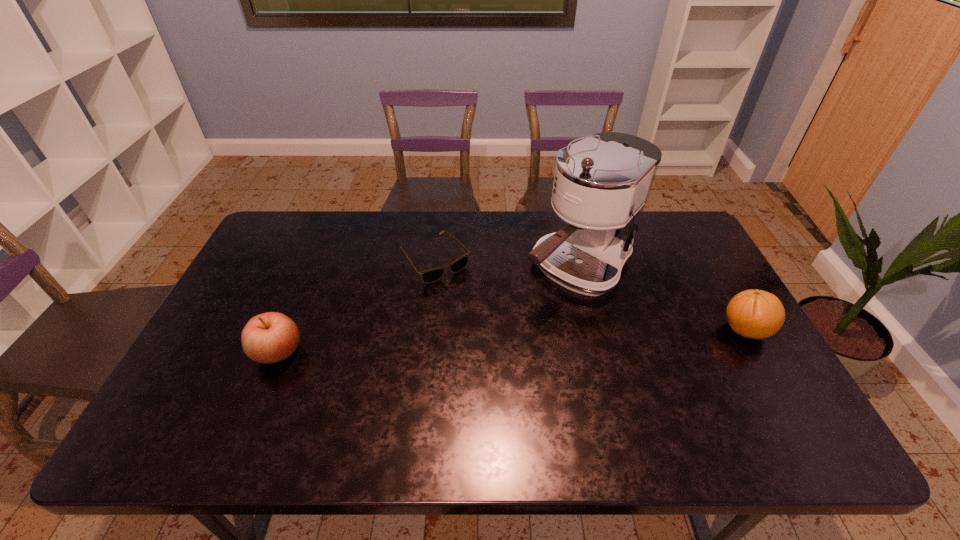
In order to click on vacant space positioned on the front-facing side of the coffee maker in this screenshot , I will do `click(450, 380)`.

Where is `blank space located on the lenses of the second object from left to right`? This screenshot has width=960, height=540. blank space located on the lenses of the second object from left to right is located at coordinates (489, 324).

At what (x,y) coordinates should I click in order to perform the action: click on free space located on the lenses of the second object from left to right. Please return your answer as a coordinate pair (x, y). Image resolution: width=960 pixels, height=540 pixels. Looking at the image, I should click on (514, 354).

Find the location of a particular element. This screenshot has height=540, width=960. vacant region located 0.160m on the lenses of the second object from left to right is located at coordinates (481, 315).

Identify the location of coffee maker at the far edge. The width and height of the screenshot is (960, 540). (601, 184).

Locate an element on the screen. This screenshot has width=960, height=540. sunglasses at the far edge is located at coordinates (429, 276).

At what (x,y) coordinates should I click in order to perform the action: click on object at the left edge. Please return your answer as a coordinate pair (x, y). Looking at the image, I should click on (270, 337).

Identify the location of object present at the right edge. The image size is (960, 540). (756, 314).

Locate an element on the screen. The height and width of the screenshot is (540, 960). free space at the far edge is located at coordinates tap(355, 245).

This screenshot has width=960, height=540. In the image, there is a desktop. Find the location of `vacant space at the near edge`. vacant space at the near edge is located at coordinates click(440, 397).